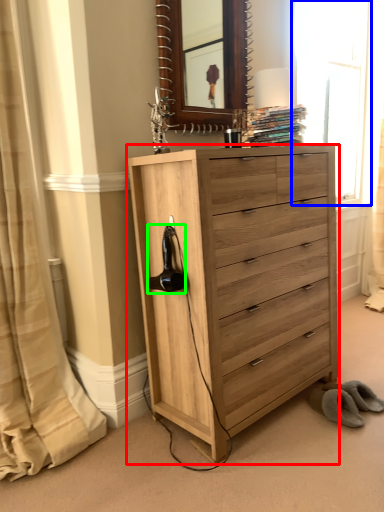
Question: Based on their relative distances, which object is nearer to chest of drawers (highlighted by a red box)? Choose from window (highlighted by a blue box) and hair drier (highlighted by a green box).

Choices:
 (A) window
 (B) hair drier

Answer: (B)